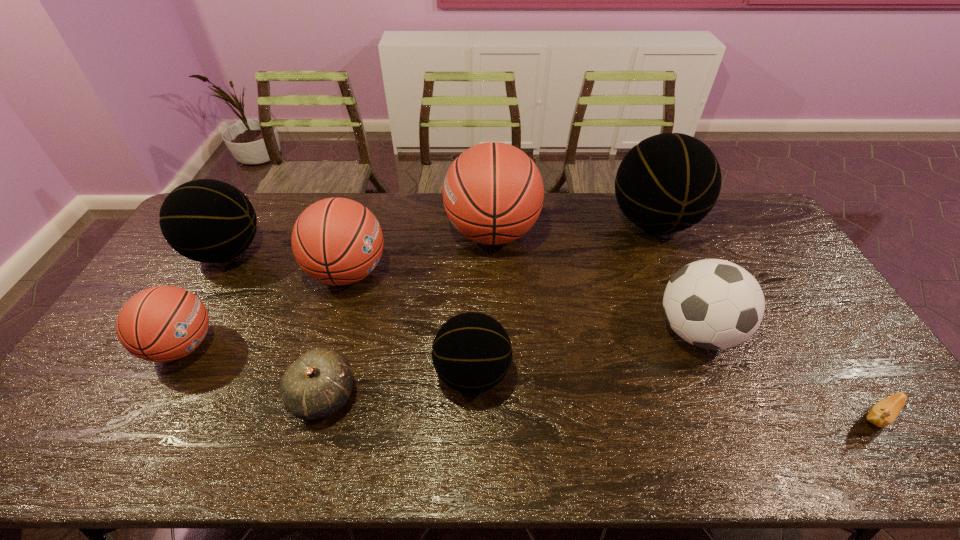
This screenshot has width=960, height=540. Identify the location of vacant space positioned 0.200m on the front of the black soccer ball. (742, 441).

Locate an element on the screen. vacant space located 0.080m on the back of the second black basketball from left to right is located at coordinates (473, 321).

This screenshot has height=540, width=960. What are the coordinates of `free space located on the logo side of the smallest orange basketball` in the screenshot? It's located at (257, 346).

This screenshot has width=960, height=540. What are the coordinates of `free space located on the right of the gourd` in the screenshot? It's located at (400, 395).

This screenshot has height=540, width=960. What are the coordinates of `vacant space positioned on the left of the yellow banana` in the screenshot? It's located at (706, 417).

This screenshot has height=540, width=960. I want to click on gourd present at the near edge, so click(x=317, y=384).

You are a GUI agent. You are given a task and a screenshot of the screen. Output one action in this format:
    pyautogui.click(x=<x>, y=<y>)
    Task: Click on the banana located at the near edge
    This screenshot has height=540, width=960.
    Given the screenshot: What is the action you would take?
    pyautogui.click(x=883, y=413)

I want to click on object situated at the right edge, so click(x=883, y=413).

Where is `object present at the far left corner`? object present at the far left corner is located at coordinates (205, 220).

Where is `object situated at the near right corner`? The image size is (960, 540). object situated at the near right corner is located at coordinates (883, 413).